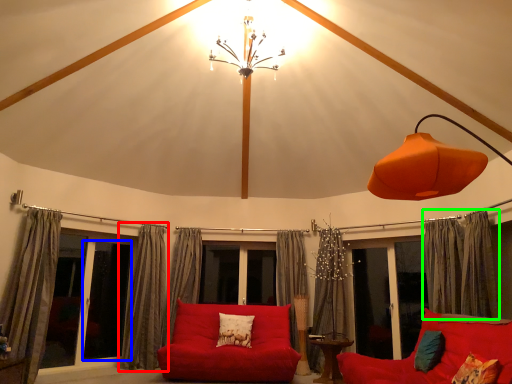
Question: Estimate the real-world distances between objects in this image. Which object is closer to curtain (highlighted by a red box), screen door (highlighted by a blue box) or curtain (highlighted by a green box)?

Choices:
 (A) screen door
 (B) curtain

Answer: (A)